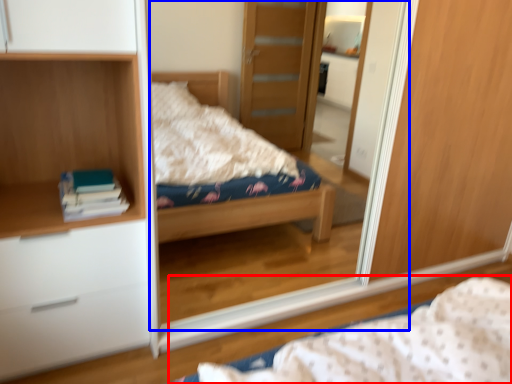
Question: Which object is further to the camera taking this photo, bed (highlighted by a red box) or mirror (highlighted by a blue box)?

Choices:
 (A) bed
 (B) mirror

Answer: (B)